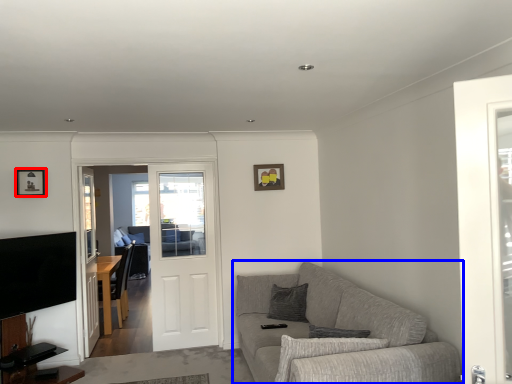
Question: Which point is closer to the camera, picture frame (highlighted by a red box) or studio couch (highlighted by a blue box)?

Choices:
 (A) picture frame
 (B) studio couch

Answer: (B)